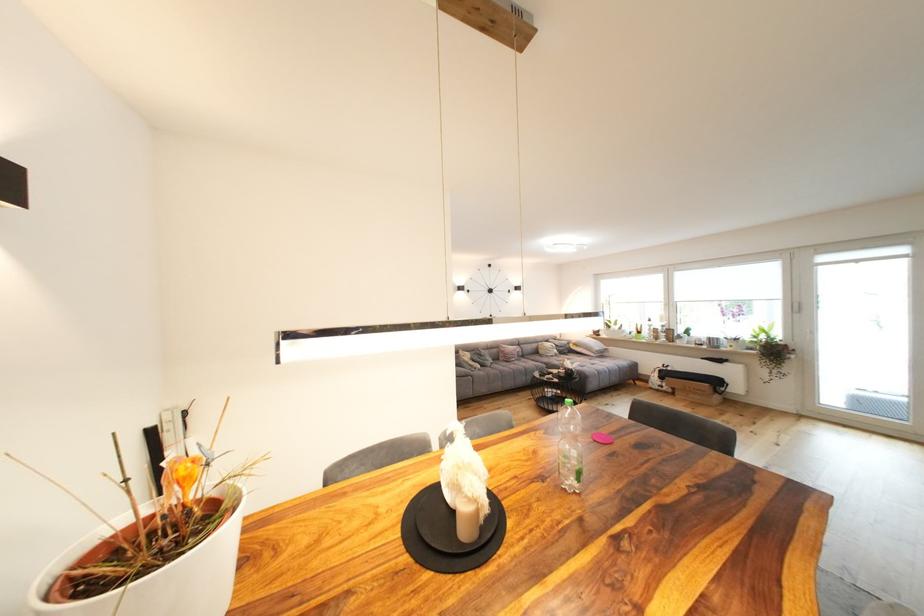
What are the coordinates of `grey pillow` in the screenshot? It's located at point(480,358).